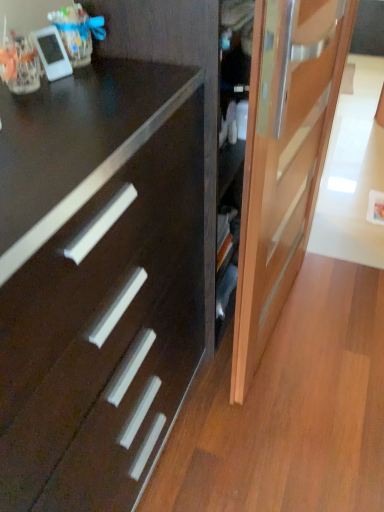
Identify the location of free space in front of light brown wooden door at right. This screenshot has height=512, width=384. (292, 412).